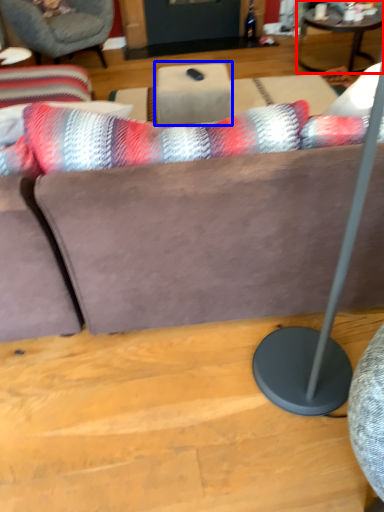
Question: Which point is closer to the camera, coffee table (highlighted by a red box) or table (highlighted by a blue box)?

Choices:
 (A) coffee table
 (B) table

Answer: (B)